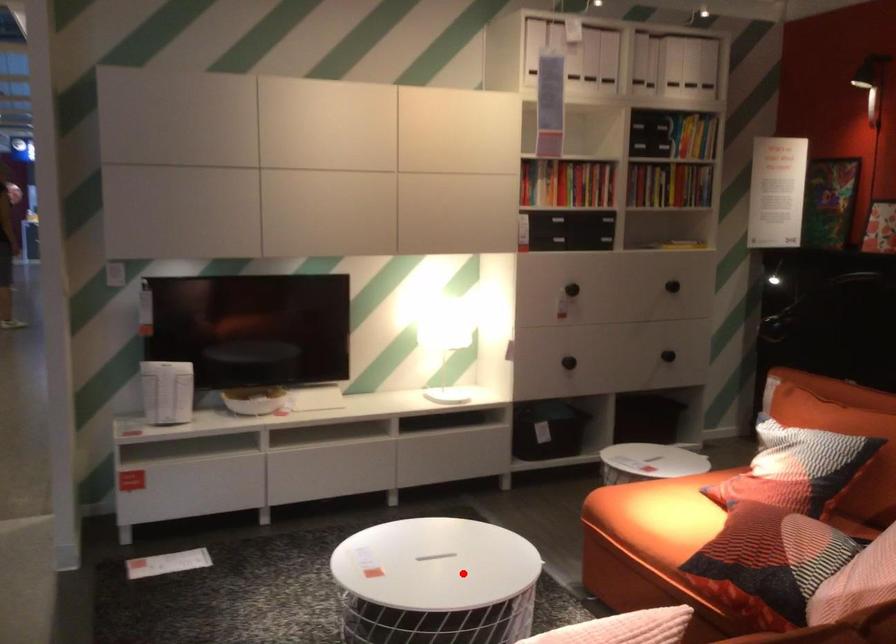
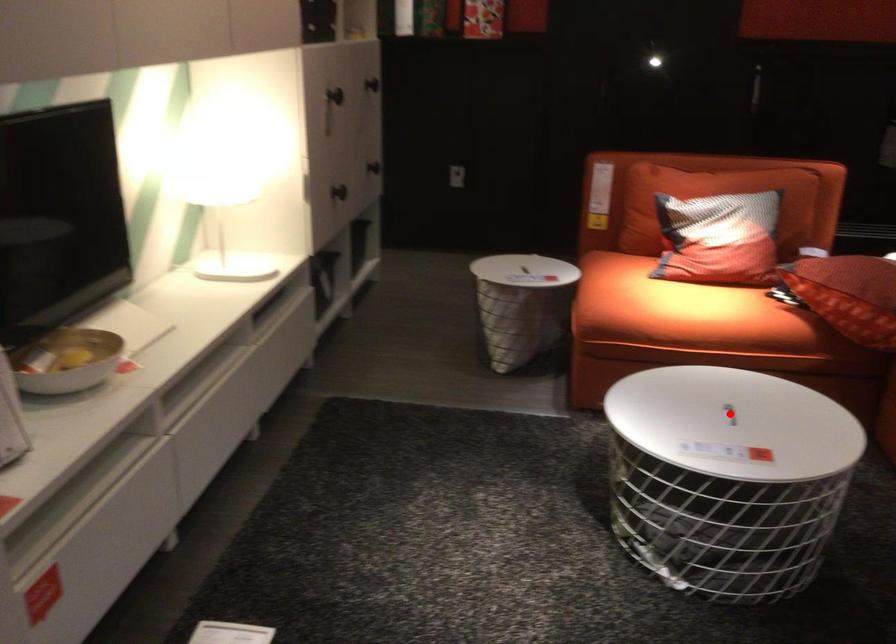
I am providing you with two images of the same scene from different viewpoints. A red point is marked on the first image and another point is marked on the second image. Are the points marked in image1 and image2 representing the same 3D position?

Yes